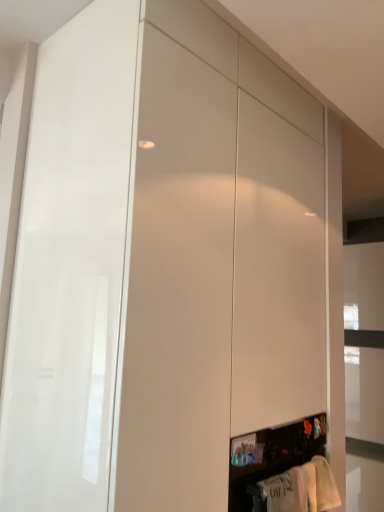
Question: Is white cotton towel at lower right, which is the 1th clothing from back to front, to the left or to the right of white cotton shirt at lower right, the first clothing in the left-to-right sequence, in the image?

Choices:
 (A) right
 (B) left

Answer: (A)

Question: From a real-world perspective, is white cotton towel at lower right, acting as the 2th clothing starting from the left, positioned above or below white cotton shirt at lower right, the first clothing positioned from the front?

Choices:
 (A) above
 (B) below

Answer: (A)

Question: Considering the positions of point (317, 502) and point (304, 474), is point (317, 502) closer or farther from the camera than point (304, 474)?

Choices:
 (A) closer
 (B) farther

Answer: (B)

Question: In terms of height, does white cotton shirt at lower right, the first clothing positioned from the front, look taller or shorter compared to white cotton towel at lower right, acting as the 2th clothing starting from the left?

Choices:
 (A) tall
 (B) short

Answer: (A)

Question: Is white cotton shirt at lower right, the 2th clothing when ordered from back to front, in front of or behind white cotton towel at lower right, acting as the 2th clothing starting from the left, in the image?

Choices:
 (A) behind
 (B) front

Answer: (B)

Question: From a real-world perspective, is white cotton shirt at lower right, the first clothing positioned from the front, physically located above or below white cotton towel at lower right, positioned as the 2th clothing in front-to-back order?

Choices:
 (A) below
 (B) above

Answer: (A)

Question: Considering the positions of white cotton shirt at lower right, the 2th clothing when ordered from back to front, and white cotton towel at lower right, placed as the 1th clothing when sorted from right to left, in the image, is white cotton shirt at lower right, the 2th clothing when ordered from back to front, wider or thinner than white cotton towel at lower right, placed as the 1th clothing when sorted from right to left,?

Choices:
 (A) thin
 (B) wide

Answer: (B)